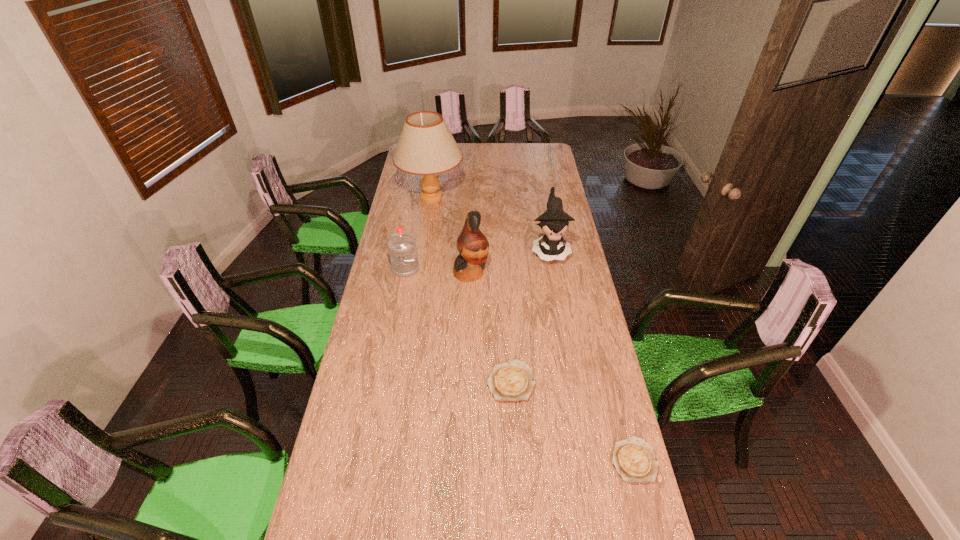
Given the evenly spaced quiches in the image, where should an extra quiche be added on the left to preserve the spacing? Please point to a vacant space. Please provide its 2D coordinates. Your answer should be formatted as a tuple, i.e. [(x, y)], where the tuple contains the x and y coordinates of a point satisfying the conditions above.

[(417, 321)]